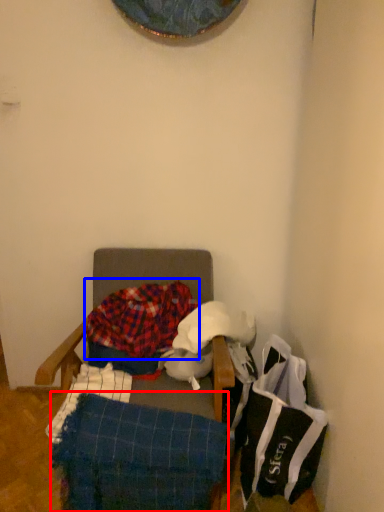
Question: Among these objects, which one is nearest to the camera, blanket (highlighted by a red box) or blanket (highlighted by a blue box)?

Choices:
 (A) blanket
 (B) blanket

Answer: (A)